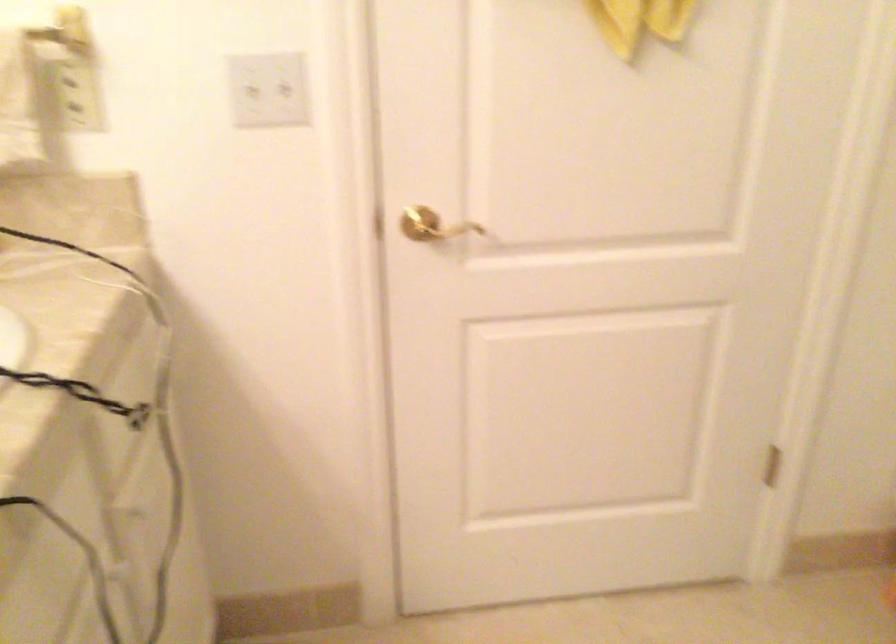
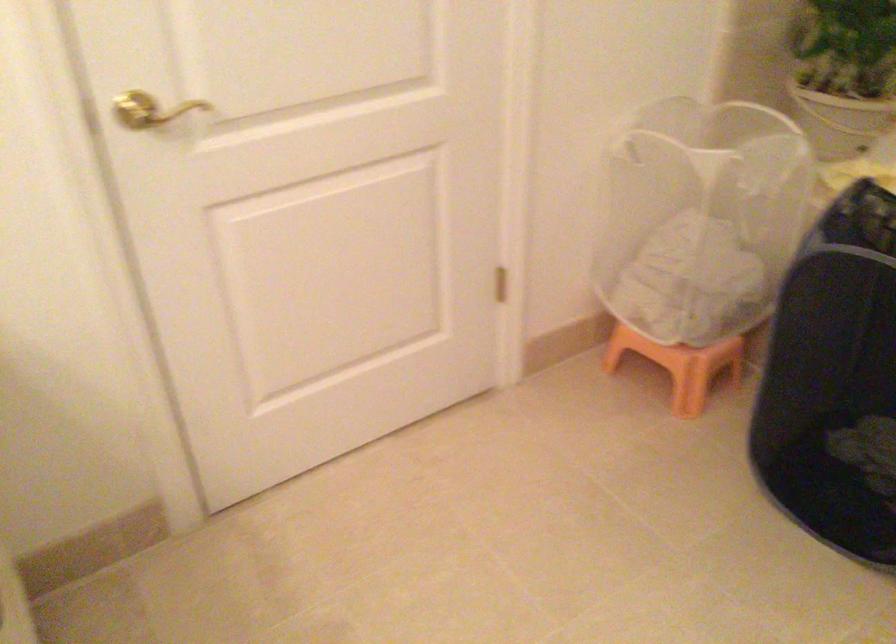
Question: The images are taken continuously from a first-person perspective. In which direction are you moving?

Choices:
 (A) Left
 (B) Right
 (C) Forward
 (D) Backward

Answer: (A)